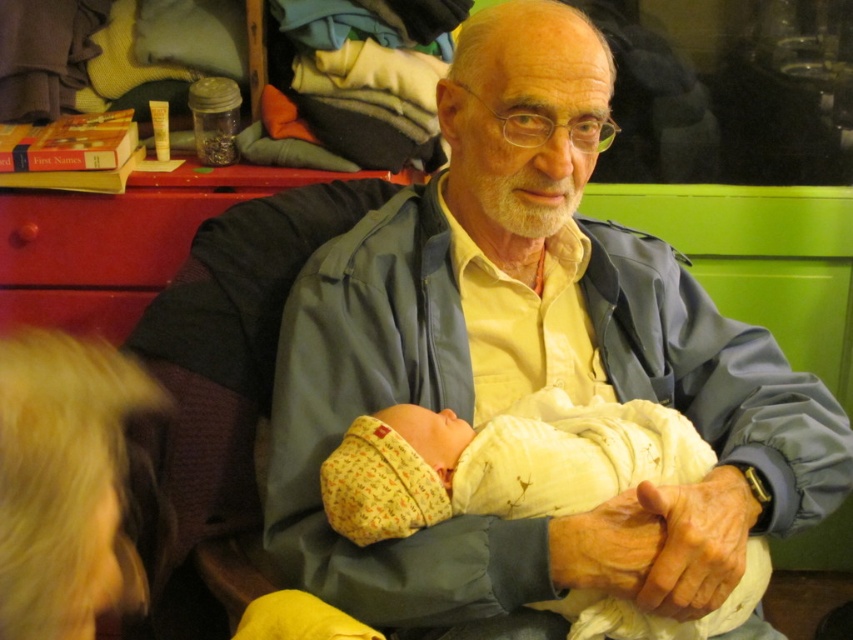
You are designing a new baby carrier that must fit over the matte blue jacket at center and securely hold the yellow cotton swaddle at center. Based on their sizes, will the carrier need to be wider to accommodate the jacket or the swaddle?

The matte blue jacket at center is wider than the yellow cotton swaddle at center, so the carrier needs to be wider to accommodate the matte blue jacket at center.

You are a caregiver who needs to wrap the baby in a swaddle. The swaddle is at center and the drawer is at left. Can you reach the yellow cotton swaddle at center before the red wood drawer at left?

The yellow cotton swaddle at center is bigger than the red wood drawer at left, so it is easier to reach the yellow cotton swaddle at center first.

You are a photographer trying to capture the interaction between the elderly man and the baby. You need to ensure that both the matte blue jacket at center and the yellow cotton swaddle at center are visible in your shot. Based on their positions, which object should you focus on first to frame the scene properly?

The yellow cotton swaddle at center should be focused on first since the matte blue jacket at center is to its right, so positioning the swaddle first ensures both elements are included in the frame.